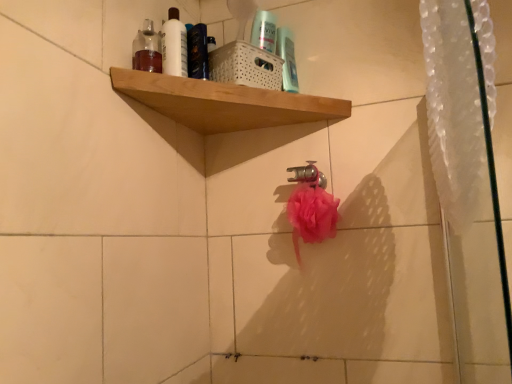
Question: Can you confirm if wooden shelf at upper center is smaller than translucent plastic bottle at upper left?

Choices:
 (A) no
 (B) yes

Answer: (A)

Question: From a real-world perspective, does wooden shelf at upper center stand above translucent plastic bottle at upper left?

Choices:
 (A) no
 (B) yes

Answer: (A)

Question: Is wooden shelf at upper center outside of translucent plastic bottle at upper left?

Choices:
 (A) no
 (B) yes

Answer: (B)

Question: Can translucent plastic bottle at upper left be found inside wooden shelf at upper center?

Choices:
 (A) no
 (B) yes

Answer: (A)

Question: Does wooden shelf at upper center have a greater width compared to translucent plastic bottle at upper left?

Choices:
 (A) no
 (B) yes

Answer: (B)

Question: Is wooden shelf at upper center positioned before translucent plastic bottle at upper left?

Choices:
 (A) no
 (B) yes

Answer: (B)

Question: Considering the relative sizes of white glossy bottle at upper center and clear plastic shower curtain at right in the image provided, is white glossy bottle at upper center shorter than clear plastic shower curtain at right?

Choices:
 (A) no
 (B) yes

Answer: (B)

Question: Considering the relative positions of white glossy bottle at upper center and clear plastic shower curtain at right in the image provided, is white glossy bottle at upper center to the left of clear plastic shower curtain at right from the viewer's perspective?

Choices:
 (A) no
 (B) yes

Answer: (B)

Question: Is white glossy bottle at upper center surrounding clear plastic shower curtain at right?

Choices:
 (A) no
 (B) yes

Answer: (A)

Question: From a real-world perspective, is white glossy bottle at upper center positioned under clear plastic shower curtain at right based on gravity?

Choices:
 (A) yes
 (B) no

Answer: (B)

Question: Can you confirm if white glossy bottle at upper center is smaller than clear plastic shower curtain at right?

Choices:
 (A) yes
 (B) no

Answer: (A)

Question: Considering the relative sizes of white glossy bottle at upper center and clear plastic shower curtain at right in the image provided, is white glossy bottle at upper center thinner than clear plastic shower curtain at right?

Choices:
 (A) yes
 (B) no

Answer: (A)

Question: Can you confirm if translucent plastic bottle at upper left is wider than wooden shelf at upper center?

Choices:
 (A) no
 (B) yes

Answer: (A)